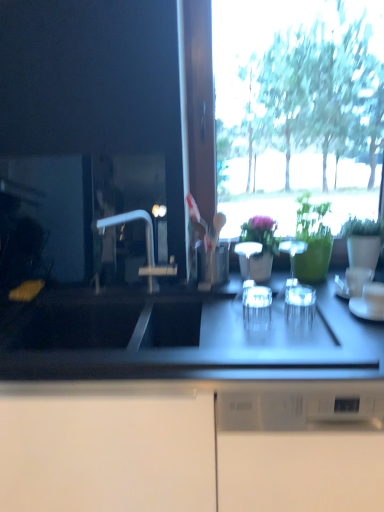
Question: Considering the relative sizes of clear glass wine glasses at center, positioned as the 5th tableware in right-to-left order, and green glossy vase at upper right, which appears as the second houseplant when viewed from the left, in the image provided, is clear glass wine glasses at center, positioned as the 5th tableware in right-to-left order, smaller than green glossy vase at upper right, which appears as the second houseplant when viewed from the left,?

Choices:
 (A) no
 (B) yes

Answer: (B)

Question: Is clear glass wine glasses at center, positioned as the 5th tableware in right-to-left order, not inside green glossy vase at upper right, which appears as the second houseplant when viewed from the left?

Choices:
 (A) no
 (B) yes

Answer: (B)

Question: Is clear glass wine glasses at center, positioned as the 5th tableware in right-to-left order, oriented away from green glossy vase at upper right, the 1th houseplant viewed from the right?

Choices:
 (A) yes
 (B) no

Answer: (A)

Question: Is clear glass wine glasses at center, acting as the 2th tableware starting from the left, far away from green glossy vase at upper right, the 1th houseplant viewed from the right?

Choices:
 (A) yes
 (B) no

Answer: (B)

Question: Are clear glass wine glasses at center, acting as the 2th tableware starting from the left, and green glossy vase at upper right, the 1th houseplant viewed from the right, beside each other?

Choices:
 (A) yes
 (B) no

Answer: (A)

Question: In terms of height, does clear glass wine glasses at center, acting as the 2th tableware starting from the left, look taller or shorter compared to green matte vase at center, marked as the second houseplant in a right-to-left arrangement?

Choices:
 (A) short
 (B) tall

Answer: (A)

Question: Is clear glass wine glasses at center, acting as the 2th tableware starting from the left, in front of or behind green matte vase at center, marked as the second houseplant in a right-to-left arrangement, in the image?

Choices:
 (A) behind
 (B) front

Answer: (B)

Question: Considering the positions of point (292, 261) and point (246, 233), is point (292, 261) closer or farther from the camera than point (246, 233)?

Choices:
 (A) farther
 (B) closer

Answer: (A)

Question: Based on their sizes in the image, would you say clear glass wine glasses at center, positioned as the 5th tableware in right-to-left order, is bigger or smaller than green matte vase at center, marked as the second houseplant in a right-to-left arrangement?

Choices:
 (A) big
 (B) small

Answer: (B)

Question: Visually, is transparent glass at center, which is counted as the 3th tableware, starting from the left, positioned to the left or to the right of green glossy vase at upper right, which appears as the second houseplant when viewed from the left?

Choices:
 (A) right
 (B) left

Answer: (B)

Question: Looking at their shapes, would you say transparent glass at center, arranged as the fourth tableware when viewed from the right, is wider or thinner than green glossy vase at upper right, the 1th houseplant viewed from the right?

Choices:
 (A) wide
 (B) thin

Answer: (B)

Question: From a real-world perspective, is transparent glass at center, arranged as the fourth tableware when viewed from the right, above or below green glossy vase at upper right, which appears as the second houseplant when viewed from the left?

Choices:
 (A) below
 (B) above

Answer: (A)

Question: From the image's perspective, is transparent glass at center, which is counted as the 3th tableware, starting from the left, above or below green glossy vase at upper right, the 1th houseplant viewed from the right?

Choices:
 (A) below
 (B) above

Answer: (A)

Question: Is white glossy cup at center, the fourth tableware viewed from the left, bigger or smaller than clear glass at center, positioned as the 6th tableware in right-to-left order?

Choices:
 (A) small
 (B) big

Answer: (A)

Question: From a real-world perspective, is white glossy cup at center, the fourth tableware viewed from the left, positioned above or below clear glass at center, placed as the 1th tableware when sorted from left to right?

Choices:
 (A) below
 (B) above

Answer: (A)